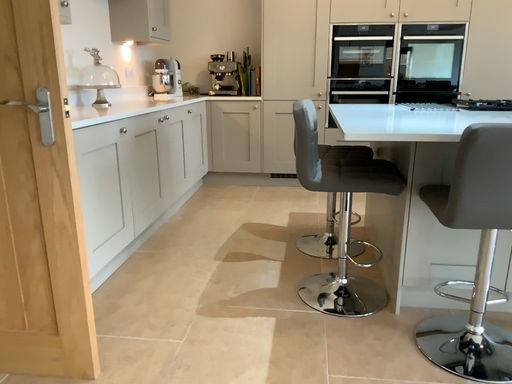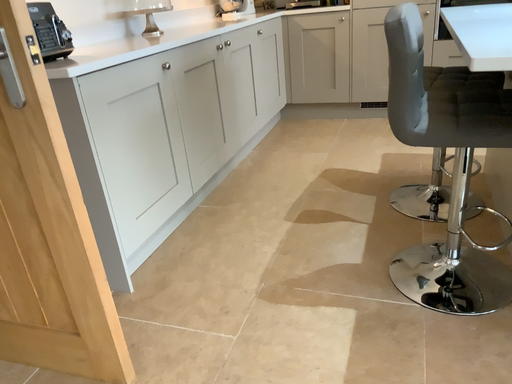
Question: How did the camera likely rotate when shooting the video?

Choices:
 (A) rotated downward
 (B) rotated upward

Answer: (A)